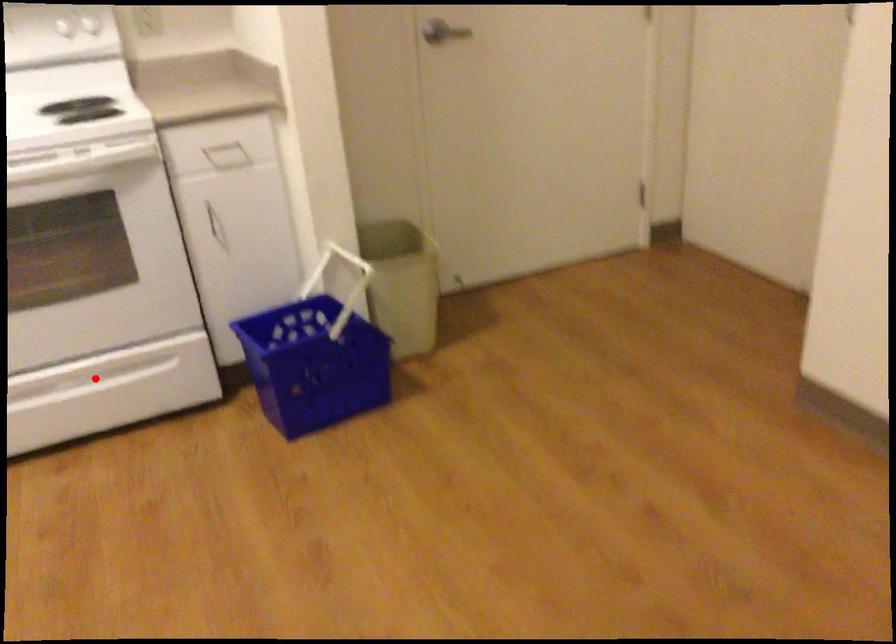
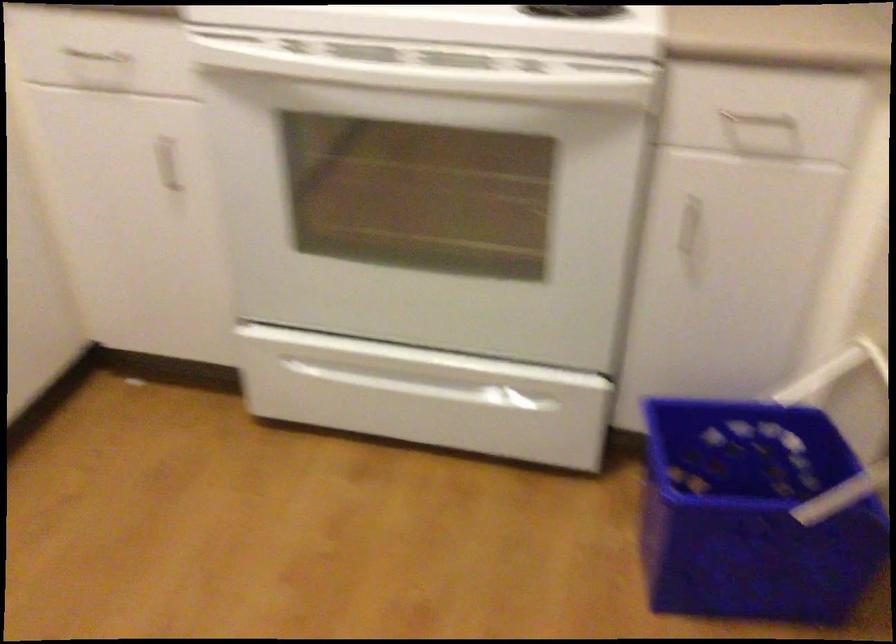
Find the pixel in the second image that matches the highlighted location in the first image.

(435, 379)